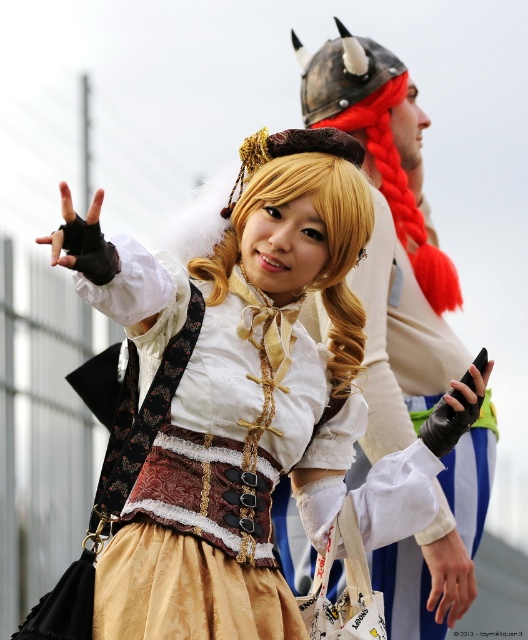
You are a photographer at a cosplay event. You need to capture a photo of the matte gold skirt at center and the white fabric helmet at upper center. Which object is wider in the image?

The matte gold skirt at center is wider than the white fabric helmet at upper center.

You are a photographer at a cosplay event. You want to capture a clear photo of the white fabric helmet at upper center. Considering the distance, is it advisable to use a telephoto lens?

The white fabric helmet at upper center is 65.72 meters from the camera, so using a telephoto lens would be advisable to capture it clearly from that distance.

You are a photographer at the cosplay event and want to take a photo that includes both the person at point (x=107, y=611) and the person at point (x=402, y=67). Which person should you focus on first to ensure they are in sharp focus?

You should focus on the person at point (x=107, y=611) first because they are closer to the viewer than the person at point (x=402, y=67). This ensures the foreground subject is sharply focused before adjusting for the background subject.